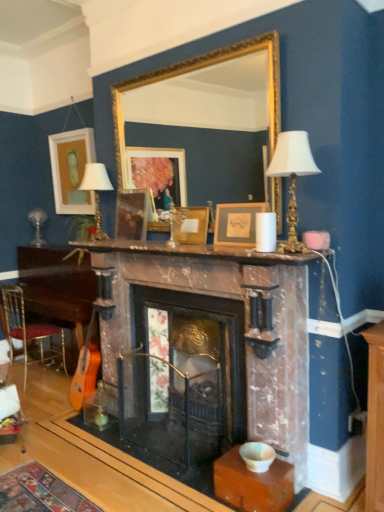
Locate an element on the screen. Image resolution: width=384 pixels, height=512 pixels. wooden picture frame at center, which is the second picture frame in back-to-front order is located at coordinates (131, 215).

Describe the element at coordinates (131, 215) in the screenshot. The image size is (384, 512). I see `wooden picture frame at center, the 3th picture frame viewed from the right` at that location.

What is the approximate height of wooden picture frame at center, which ranks as the 2th picture frame in front-to-back order?

wooden picture frame at center, which ranks as the 2th picture frame in front-to-back order, is 12.97 inches in height.

Image resolution: width=384 pixels, height=512 pixels. What do you see at coordinates (191, 225) in the screenshot?
I see `wooden picture frame at center, which ranks as the 2th picture frame in front-to-back order` at bounding box center [191, 225].

What are the coordinates of `matte gold picture frame at center, positioned as the 4th picture frame in back-to-front order` in the screenshot? It's located at coord(237,224).

You are a GUI agent. You are given a task and a screenshot of the screen. Output one action in this format:
    pyautogui.click(x=<x>, y=<y>)
    Task: Click on the marble fireplace at center
    
    Given the screenshot: What is the action you would take?
    pyautogui.click(x=205, y=349)

Is matte gold picture frame at center, which is counted as the first picture frame, starting from the front, touching white porcelain table lamp at upper center, the second table lamp viewed from the left?

No, matte gold picture frame at center, which is counted as the first picture frame, starting from the front, is not next to white porcelain table lamp at upper center, the second table lamp viewed from the left.

Image resolution: width=384 pixels, height=512 pixels. I want to click on table lamp on the right of matte gold picture frame at center, which is counted as the first picture frame, starting from the front, so click(292, 176).

Which of these two, matte gold picture frame at center, positioned as the 4th picture frame in back-to-front order, or white porcelain table lamp at upper center, the second table lamp viewed from the left, stands shorter?

matte gold picture frame at center, positioned as the 4th picture frame in back-to-front order, is shorter.

How many degrees apart are the facing directions of matte gold picture frame at center, the first picture frame when ordered from right to left, and white porcelain table lamp at upper center, the second table lamp viewed from the left?

matte gold picture frame at center, the first picture frame when ordered from right to left, and white porcelain table lamp at upper center, the second table lamp viewed from the left, are facing 0.763 degrees away from each other.

Can you confirm if marble mantel at center is thinner than wooden table at lower left?

Yes.

From the image's perspective, does marble mantel at center appear higher than wooden table at lower left?

Yes.

Consider the image. Does metallic gold chair at lower left turn towards white matte picture frame at upper left, the 4th picture frame when ordered from right to left?

No, metallic gold chair at lower left is not turned towards white matte picture frame at upper left, the 4th picture frame when ordered from right to left.

Considering their positions, is metallic gold chair at lower left located in front of or behind white matte picture frame at upper left, which is the first picture frame from left to right?

Visually, metallic gold chair at lower left is located in front of white matte picture frame at upper left, which is the first picture frame from left to right.

Does metallic gold chair at lower left appear on the right side of white matte picture frame at upper left, placed as the fourth picture frame when sorted from front to back?

In fact, metallic gold chair at lower left is to the left of white matte picture frame at upper left, placed as the fourth picture frame when sorted from front to back.

Does metallic gold chair at lower left have a greater width compared to white matte picture frame at upper left, the 4th picture frame when ordered from right to left?

Yes.

In the image, is white porcelain table lamp at upper center, marked as the first table lamp in a front-to-back arrangement, positioned in front of or behind matte white lampshade at upper left, which ranks as the first table lamp in left-to-right order?

white porcelain table lamp at upper center, marked as the first table lamp in a front-to-back arrangement, is in front of matte white lampshade at upper left, which ranks as the first table lamp in left-to-right order.

Which of these two, white porcelain table lamp at upper center, marked as the first table lamp in a front-to-back arrangement, or matte white lampshade at upper left, placed as the second table lamp when sorted from right to left, is smaller?

Smaller between the two is matte white lampshade at upper left, placed as the second table lamp when sorted from right to left.

Does white porcelain table lamp at upper center, marked as the first table lamp in a front-to-back arrangement, turn towards matte white lampshade at upper left, which ranks as the first table lamp in left-to-right order?

No, white porcelain table lamp at upper center, marked as the first table lamp in a front-to-back arrangement, does not turn towards matte white lampshade at upper left, which ranks as the first table lamp in left-to-right order.

Looking at this image, is white porcelain table lamp at upper center, the first table lamp in the right-to-left sequence, wider than matte white lampshade at upper left, acting as the second table lamp starting from the front?

Incorrect, the width of white porcelain table lamp at upper center, the first table lamp in the right-to-left sequence, does not surpass that of matte white lampshade at upper left, acting as the second table lamp starting from the front.

Considering the points (41, 317) and (289, 251), which point is in front, point (41, 317) or point (289, 251)?

The point (289, 251) is closer.

Does wooden table at lower left come in front of white porcelain table lamp at upper center, which is the second table lamp from back to front?

No, wooden table at lower left is behind white porcelain table lamp at upper center, which is the second table lamp from back to front.

From the image's perspective, which is above, wooden table at lower left or white porcelain table lamp at upper center, which is the second table lamp from back to front?

white porcelain table lamp at upper center, which is the second table lamp from back to front, appears higher in the image.

Can you tell me how much wooden table at lower left and white porcelain table lamp at upper center, the second table lamp viewed from the left, differ in facing direction?

The angular difference between wooden table at lower left and white porcelain table lamp at upper center, the second table lamp viewed from the left, is 0.439 degrees.

Is matte gold picture frame at center, which is counted as the first picture frame, starting from the front, placed right next to wooden picture frame at center, the 3th picture frame viewed from the right?

matte gold picture frame at center, which is counted as the first picture frame, starting from the front, and wooden picture frame at center, the 3th picture frame viewed from the right, are clearly separated.

Is matte gold picture frame at center, which is counted as the first picture frame, starting from the front, oriented towards wooden picture frame at center, the 3th picture frame viewed from the right?

No, matte gold picture frame at center, which is counted as the first picture frame, starting from the front, is not aimed at wooden picture frame at center, the 3th picture frame viewed from the right.

Looking at this image, from a real-world perspective, relative to wooden picture frame at center, which is the second picture frame in back-to-front order, is matte gold picture frame at center, the first picture frame when ordered from right to left, vertically above or below?

Clearly, from a real-world perspective, matte gold picture frame at center, the first picture frame when ordered from right to left, is below wooden picture frame at center, which is the second picture frame in back-to-front order.

Is matte gold picture frame at center, which is counted as the first picture frame, starting from the front, oriented towards wooden picture frame at center, which is the 3th picture frame in back-to-front order?

No, matte gold picture frame at center, which is counted as the first picture frame, starting from the front, is not turned towards wooden picture frame at center, which is the 3th picture frame in back-to-front order.

From the picture: Are matte gold picture frame at center, which is counted as the first picture frame, starting from the front, and wooden picture frame at center, which appears as the 2th picture frame when viewed from the right, located far from each other?

They are positioned close to each other.

From the image's perspective, is matte gold picture frame at center, the first picture frame when ordered from right to left, located above or below wooden picture frame at center, which appears as the 2th picture frame when viewed from the right?

From the image's perspective, matte gold picture frame at center, the first picture frame when ordered from right to left, appears below wooden picture frame at center, which appears as the 2th picture frame when viewed from the right.

What's the angular difference between matte gold picture frame at center, positioned as the 4th picture frame in back-to-front order, and wooden picture frame at center, which is the 3th picture frame in back-to-front order,'s facing directions?

They differ by 0.00167 degrees in their facing directions.

This screenshot has height=512, width=384. Find the location of `the 1st picture frame behind the white porcelain table lamp at upper center, which is the second table lamp from back to front, starting your count from the anchor`. the 1st picture frame behind the white porcelain table lamp at upper center, which is the second table lamp from back to front, starting your count from the anchor is located at coordinates (237, 224).

At what (x,y) coordinates should I click in order to perform the action: click on mantle on the right side of wooden table at lower left. Please return your answer as a coordinate pair (x, y). This screenshot has height=512, width=384. Looking at the image, I should click on (196, 252).

Which object lies further to the anchor point gold/gilded mirror at upper center, metallic gold chair at lower left or matte gold picture frame at center, which is counted as the first picture frame, starting from the front?

Among the two, metallic gold chair at lower left is located further to gold/gilded mirror at upper center.

Considering their positions, is wooden table at lower left positioned further to white porcelain table lamp at upper center, which is the second table lamp from back to front, than wooden picture frame at center, the 3th picture frame from the left?

wooden table at lower left is further to white porcelain table lamp at upper center, which is the second table lamp from back to front.

From the image, which object appears to be nearer to gold/gilded mirror at upper center, wooden picture frame at center, which is the 2th picture frame from left to right, or wooden table at lower left?

wooden picture frame at center, which is the 2th picture frame from left to right, lies closer to gold/gilded mirror at upper center than the other object.

Considering their positions, is matte white lampshade at upper left, acting as the second table lamp starting from the front, positioned closer to white matte picture frame at upper left, the first picture frame from the back, than matte gold picture frame at center, arranged as the 4th picture frame when viewed from the left?

matte white lampshade at upper left, acting as the second table lamp starting from the front, is closer to white matte picture frame at upper left, the first picture frame from the back.

Based on their spatial positions, is wooden picture frame at center, which is the 2th picture frame from left to right, or matte white lampshade at upper left, which ranks as the first table lamp in left-to-right order, closer to white porcelain table lamp at upper center, which is the second table lamp from back to front?

The object closer to white porcelain table lamp at upper center, which is the second table lamp from back to front, is wooden picture frame at center, which is the 2th picture frame from left to right.

Looking at the image, which one is located closer to wooden table at lower left, metallic gold chair at lower left or wooden picture frame at center, which is the second picture frame in back-to-front order?

Among the two, metallic gold chair at lower left is located nearer to wooden table at lower left.

Based on their spatial positions, is wooden table at lower left or gold/gilded mirror at upper center further from matte gold picture frame at center, arranged as the 4th picture frame when viewed from the left?

The object further to matte gold picture frame at center, arranged as the 4th picture frame when viewed from the left, is wooden table at lower left.

Which object lies nearer to the anchor point matte gold picture frame at center, which is counted as the first picture frame, starting from the front, wooden picture frame at center, the 3th picture frame viewed from the right, or white matte picture frame at upper left, placed as the fourth picture frame when sorted from front to back?

Among the two, wooden picture frame at center, the 3th picture frame viewed from the right, is located nearer to matte gold picture frame at center, which is counted as the first picture frame, starting from the front.

Where is `mirror between wooden table at lower left and white porcelain table lamp at upper center, the second table lamp viewed from the left, from left to right`? mirror between wooden table at lower left and white porcelain table lamp at upper center, the second table lamp viewed from the left, from left to right is located at coordinates (197, 69).

What are the coordinates of `table located between metallic gold chair at lower left and gold/gilded mirror at upper center in the left-right direction` in the screenshot? It's located at (62, 302).

Find the location of `picture frame between marble mantel at center and wooden picture frame at center, which appears as the 2th picture frame when viewed from the right, along the z-axis`. picture frame between marble mantel at center and wooden picture frame at center, which appears as the 2th picture frame when viewed from the right, along the z-axis is located at coordinates (237, 224).

At what (x,y) coordinates should I click in order to perform the action: click on fireplace between metallic gold chair at lower left and white porcelain table lamp at upper center, which is the second table lamp from back to front, from left to right. Please return your answer as a coordinate pair (x, y). This screenshot has height=512, width=384. Looking at the image, I should click on (205, 349).